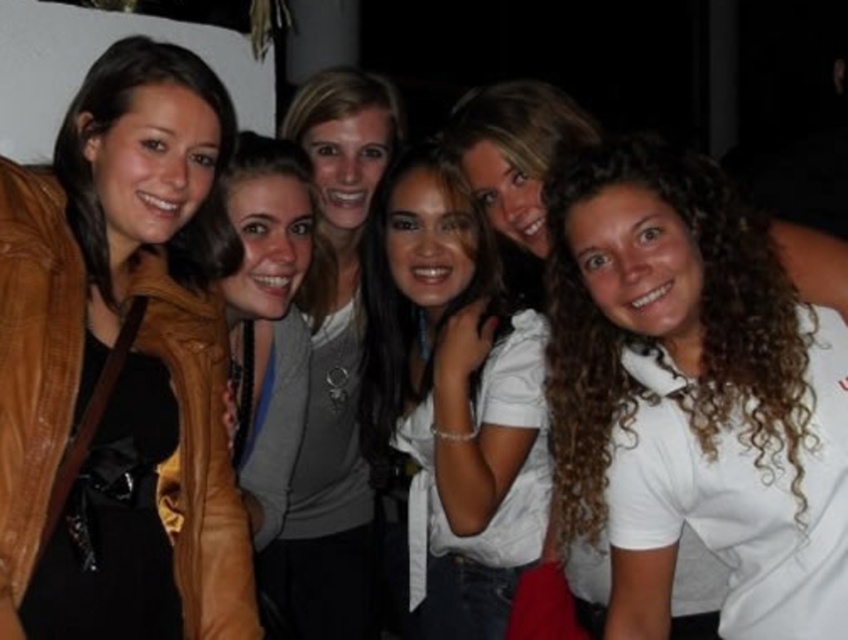
Question: Which point appears closest to the camera in this image?

Choices:
 (A) (612, 564)
 (B) (155, 573)
 (C) (523, 483)

Answer: (B)

Question: Does brown leather jacket at left lie in front of white matte shirt at center?

Choices:
 (A) yes
 (B) no

Answer: (A)

Question: Which point appears farthest from the camera in this image?

Choices:
 (A) (235, 609)
 (B) (654, 556)
 (C) (470, 440)
 (D) (299, 532)

Answer: (D)

Question: Does brown leather jacket at left have a smaller size compared to white matte shirt at center?

Choices:
 (A) no
 (B) yes

Answer: (B)

Question: Is white matte shirt at right to the right of matte gray sweater at center from the viewer's perspective?

Choices:
 (A) no
 (B) yes

Answer: (B)

Question: Among these objects, which one is farthest from the camera?

Choices:
 (A) white matte shirt at center
 (B) white matte shirt at right
 (C) matte gray sweater at center
 (D) brown leather jacket at left

Answer: (C)